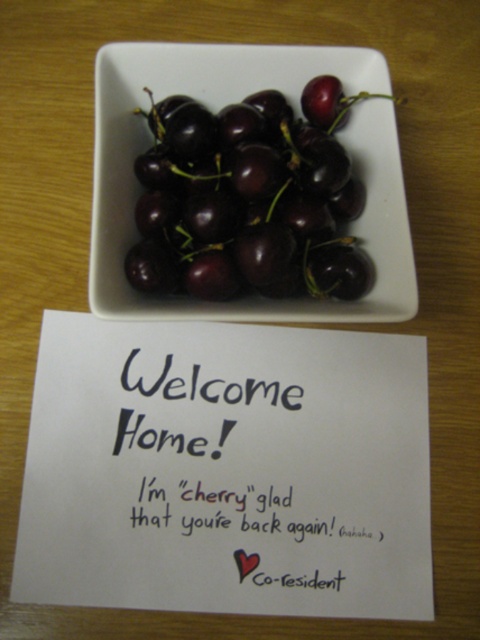
Question: Which object appears closest to the camera in this image?

Choices:
 (A) black paper at upper center
 (B) shiny dark red cherries at center

Answer: (B)

Question: Does shiny dark red cherries at center have a lesser width compared to black paper at upper center?

Choices:
 (A) yes
 (B) no

Answer: (B)

Question: Observing the image, what is the correct spatial positioning of shiny dark red cherries at center in reference to black paper at upper center?

Choices:
 (A) left
 (B) right

Answer: (B)

Question: Which point is farther to the camera?

Choices:
 (A) (345, 280)
 (B) (240, 388)

Answer: (B)

Question: Can you confirm if shiny dark red cherries at center is positioned below black paper at upper center?

Choices:
 (A) no
 (B) yes

Answer: (A)

Question: Which point is closer to the camera?

Choices:
 (A) shiny dark red cherries at center
 (B) black paper at upper center

Answer: (A)